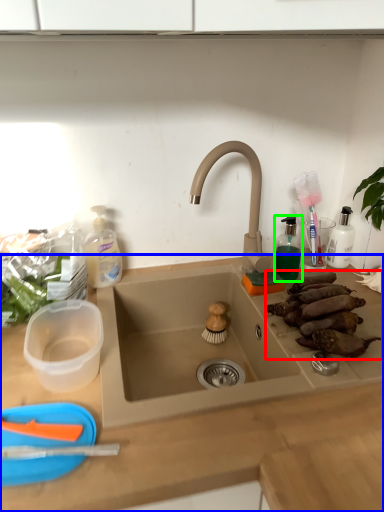
Question: Estimate the real-world distances between objects in this image. Which object is farther from food (highlighted by a red box), countertop (highlighted by a blue box) or toiletry (highlighted by a green box)?

Choices:
 (A) countertop
 (B) toiletry

Answer: (A)